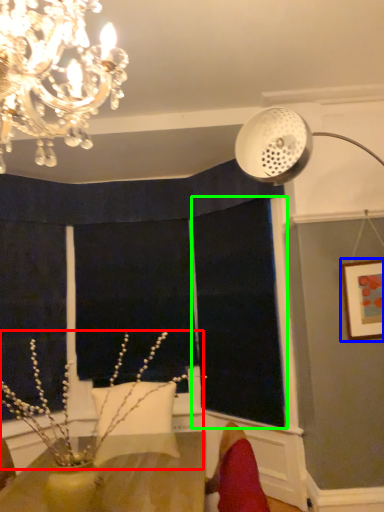
Question: Estimate the real-world distances between objects in this image. Which object is closer to plant (highlighted by a red box), picture frame (highlighted by a blue box) or window screen (highlighted by a green box)?

Choices:
 (A) picture frame
 (B) window screen

Answer: (B)